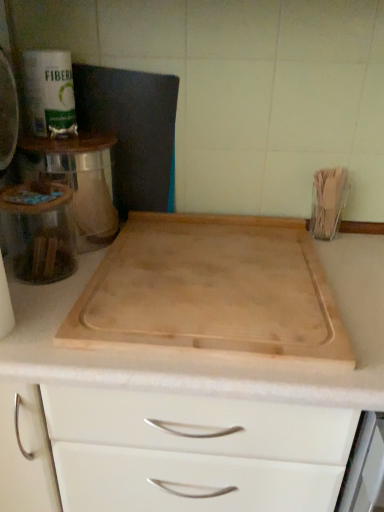
Where is `free spot to the right of clear glass jar at left, positioned as the 1th appliance in bottom-to-top order`? This screenshot has width=384, height=512. free spot to the right of clear glass jar at left, positioned as the 1th appliance in bottom-to-top order is located at coordinates (106, 289).